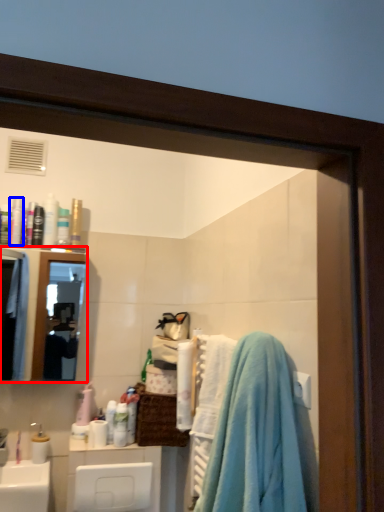
Question: Which object appears closest to the camera in this image, mirror (highlighted by a red box) or toiletry (highlighted by a blue box)?

Choices:
 (A) mirror
 (B) toiletry

Answer: (A)